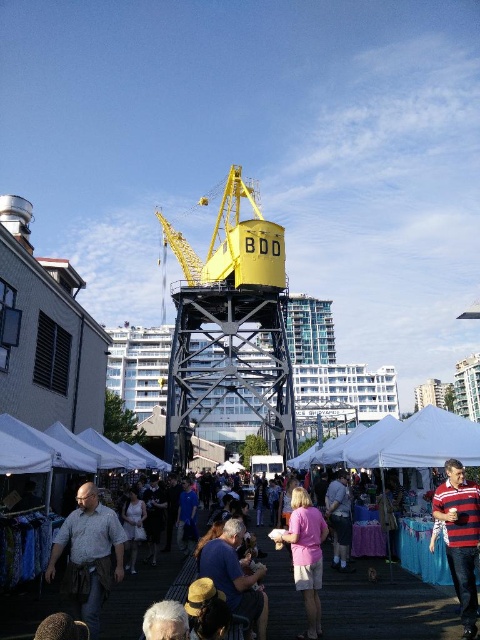
How much distance is there between brown leather belt at center and matte gray shirt at center?

brown leather belt at center is 19.61 meters from matte gray shirt at center.

Can you confirm if brown leather belt at center is bigger than matte gray shirt at center?

Yes, brown leather belt at center is bigger than matte gray shirt at center.

Locate an element on the screen. The height and width of the screenshot is (640, 480). brown leather belt at center is located at coordinates (88, 554).

Who is taller, striped fabric shirt at center or pink cotton shirt at center?

With more height is striped fabric shirt at center.

Can you confirm if striped fabric shirt at center is positioned to the right of pink cotton shirt at center?

Yes, striped fabric shirt at center is to the right of pink cotton shirt at center.

This screenshot has height=640, width=480. Describe the element at coordinates (460, 538) in the screenshot. I see `striped fabric shirt at center` at that location.

Find the location of a particular element. striped fabric shirt at center is located at coordinates (460, 538).

In the scene shown: Which of these two, yellow matte tower at center or brown leather belt at center, stands taller?

yellow matte tower at center

Is yellow matte tower at center wider than brown leather belt at center?

Correct, the width of yellow matte tower at center exceeds that of brown leather belt at center.

What do you see at coordinates (230, 324) in the screenshot? I see `yellow matte tower at center` at bounding box center [230, 324].

Where is `yellow matte tower at center`? yellow matte tower at center is located at coordinates pyautogui.click(x=230, y=324).